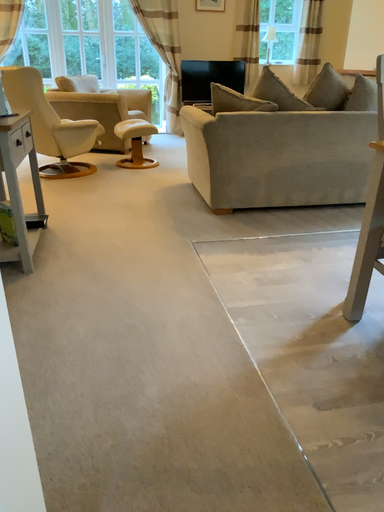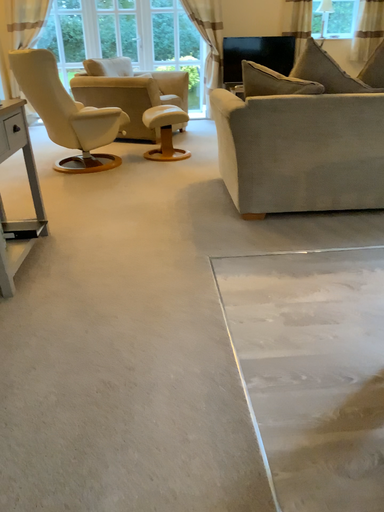
Question: Which way did the camera rotate in the video?

Choices:
 (A) rotated right
 (B) rotated left

Answer: (B)